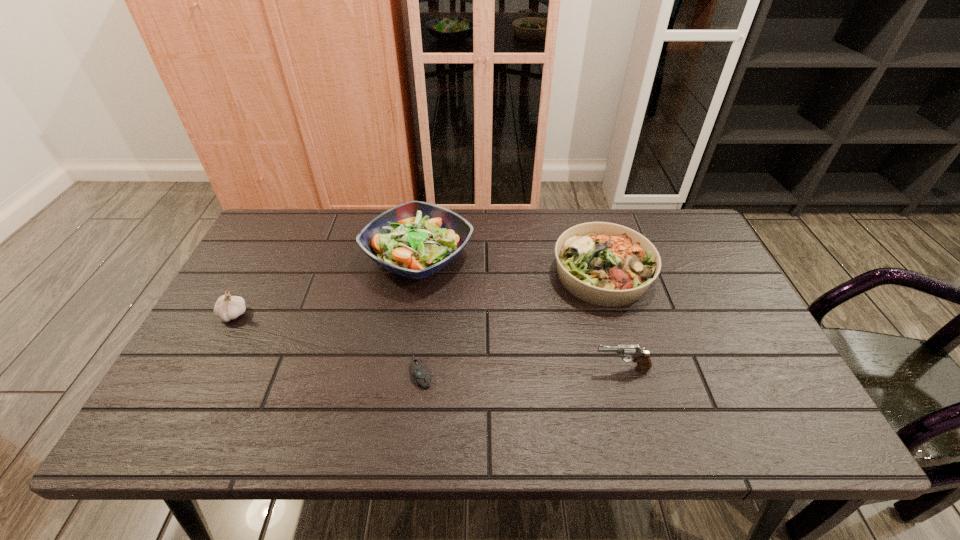
I want to click on the left salad plate, so click(x=416, y=239).

The width and height of the screenshot is (960, 540). I want to click on the tallest object, so click(416, 239).

This screenshot has height=540, width=960. In order to click on the leftmost object in this screenshot , I will do `click(227, 307)`.

What are the coordinates of `pistol` in the screenshot? It's located at (642, 357).

Locate an element on the screen. the right salad plate is located at coordinates (606, 264).

This screenshot has width=960, height=540. I want to click on the shortest object, so click(x=420, y=374).

At what (x,y) coordinates should I click in order to perform the action: click on free point located on the back of the tallest object. Please return your answer as a coordinate pair (x, y). Looking at the image, I should click on (425, 209).

Locate an element on the screen. This screenshot has width=960, height=540. vacant space located 0.220m on the front of the garlic is located at coordinates (187, 402).

Locate an element on the screen. vacant region located 0.190m at the barrel of the pistol is located at coordinates (512, 368).

What are the coordinates of `free space located at the barrel of the pistol` in the screenshot? It's located at (483, 368).